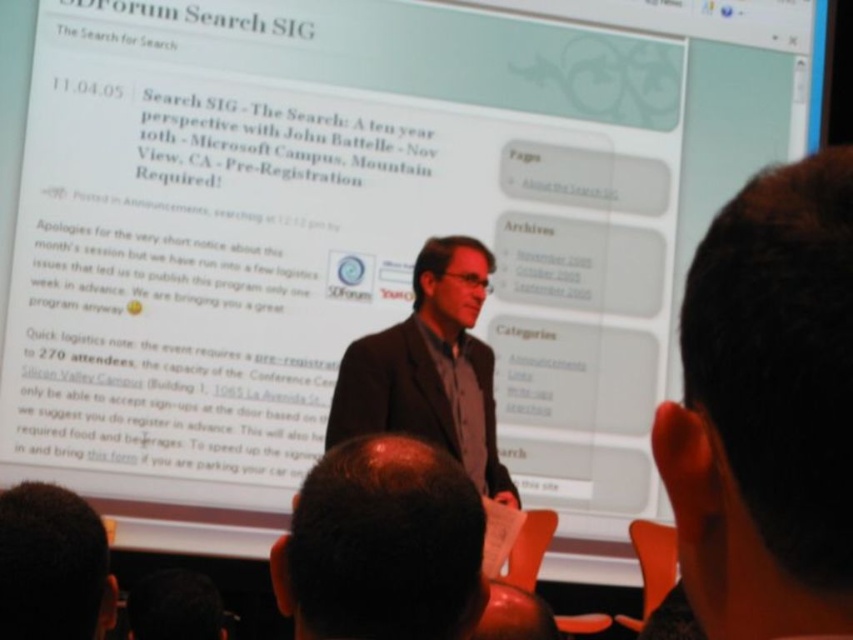
You are sitting in the audience and want to see both the dark gray suit at center and the dark brown hair at lower left. Which one is closer to the front of the stage?

The dark gray suit at center is positioned over dark brown hair at lower left, so the dark gray suit at center is closer to the front of the stage.

You are sitting at the back of the conference room and want to get a better view of the screen. There are two people in front of you with dark brown hair at upper right and brown hair at center. Which person should you ask to move so you can see the screen better?

You should ask the dark brown hair at upper right to move because they are in front of the brown hair at center, blocking your view more directly.